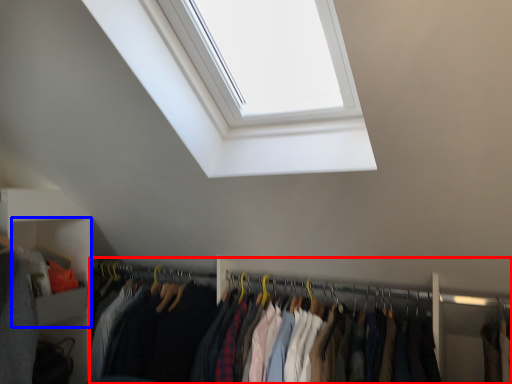
Question: Which point is further to the camera, closet (highlighted by a red box) or cabinet (highlighted by a blue box)?

Choices:
 (A) closet
 (B) cabinet

Answer: (B)